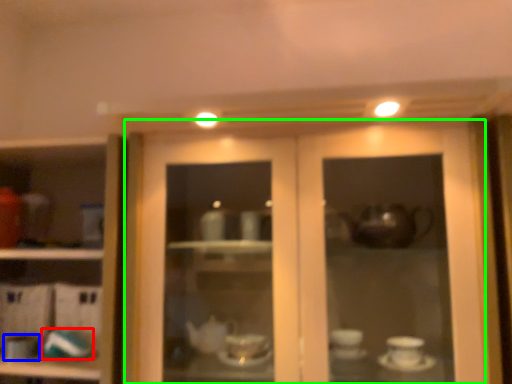
Question: Estimate the real-world distances between objects in this image. Which object is closer to tableware (highlighted by a red box), tableware (highlighted by a blue box) or door (highlighted by a green box)?

Choices:
 (A) tableware
 (B) door

Answer: (A)